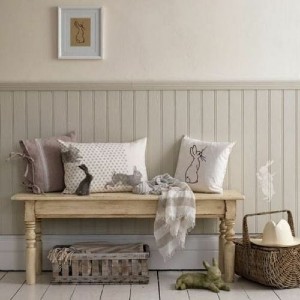
Locate an element on the screen. This screenshot has width=300, height=300. white wood floor plank is located at coordinates (152, 289).